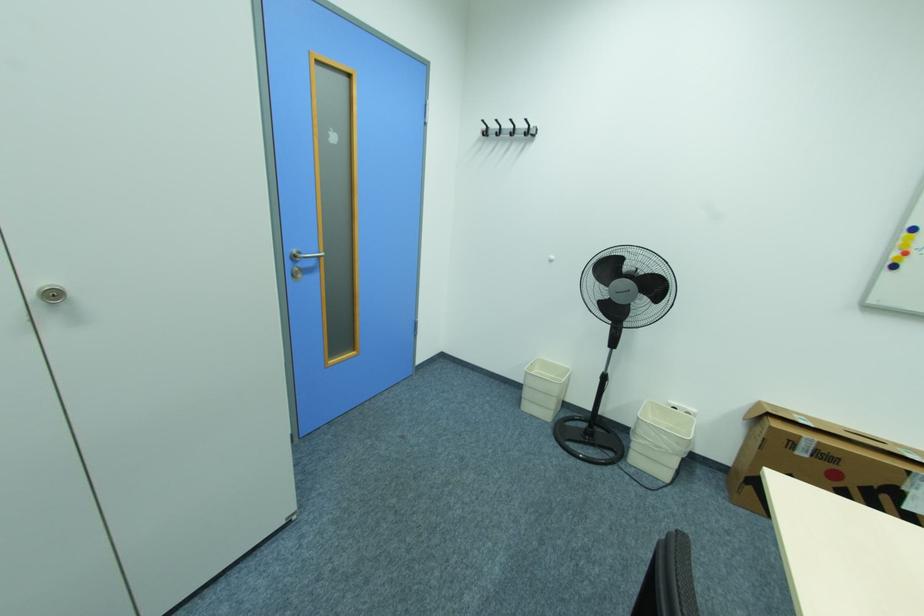
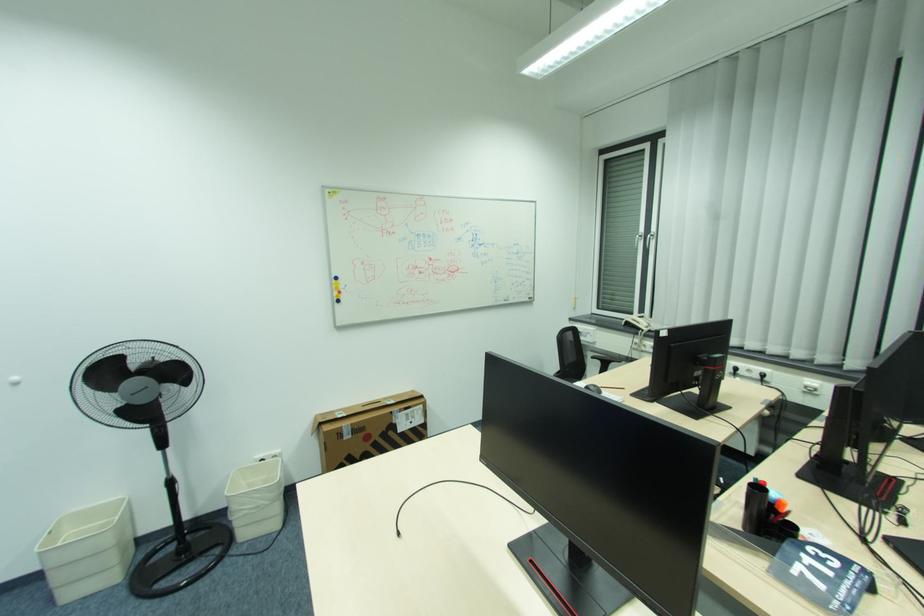
Locate, in the second image, the point that corresponds to [664,448] in the first image.

(263, 507)